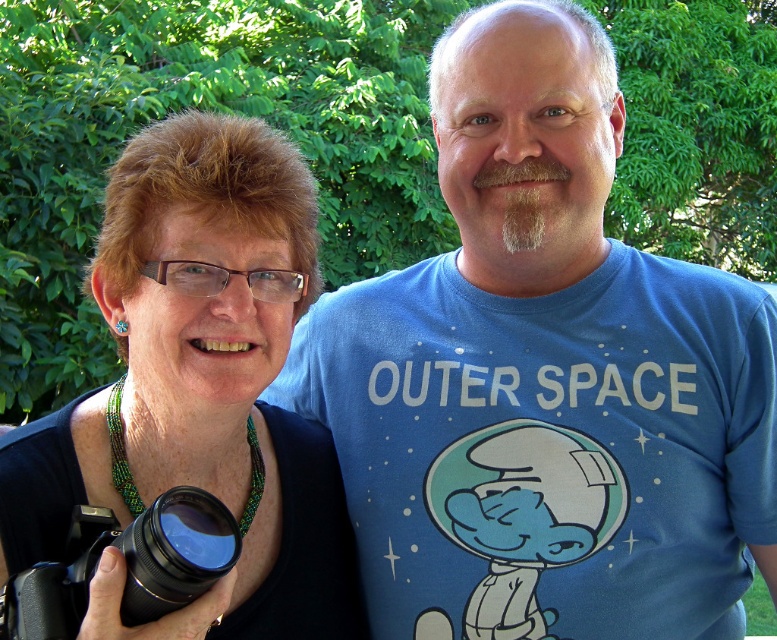
Question: Does black matte camera at left appear on the right side of black plastic camera at lower left?

Choices:
 (A) yes
 (B) no

Answer: (B)

Question: Among these objects, which one is farthest from the camera?

Choices:
 (A) black matte camera at left
 (B) black plastic camera at lower left

Answer: (A)

Question: Does black matte camera at left appear on the left side of black plastic camera at lower left?

Choices:
 (A) no
 (B) yes

Answer: (B)

Question: Is black matte camera at left bigger than black plastic camera at lower left?

Choices:
 (A) yes
 (B) no

Answer: (A)

Question: Among these points, which one is nearest to the camera?

Choices:
 (A) (162, 444)
 (B) (68, 573)

Answer: (B)

Question: Which of the following is the closest to the observer?

Choices:
 (A) black matte camera at left
 (B) black plastic camera at lower left

Answer: (B)